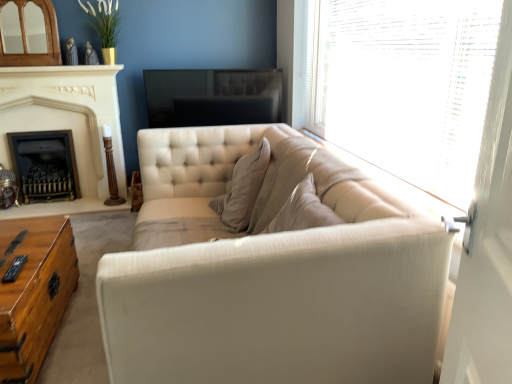
Question: From a real-world perspective, is wooden trunk at lower left above or below white stone fireplace at left, the 2th fireplace in the left-to-right sequence?

Choices:
 (A) below
 (B) above

Answer: (A)

Question: From their relative heights in the image, would you say wooden trunk at lower left is taller or shorter than white stone fireplace at left, the 2th fireplace in the left-to-right sequence?

Choices:
 (A) short
 (B) tall

Answer: (A)

Question: Considering the real-world distances, which object is farthest from the satin beige couch at center?

Choices:
 (A) wooden trunk at lower left
 (B) black metal fireplace at left, positioned as the first fireplace in left-to-right order
 (C) translucent wood blinds at upper right
 (D) white stone fireplace at left, positioned as the 1th fireplace in right-to-left order

Answer: (B)

Question: Which of these objects is positioned closest to the white stone fireplace at left, positioned as the 1th fireplace in right-to-left order?

Choices:
 (A) wooden trunk at lower left
 (B) satin beige couch at center
 (C) translucent wood blinds at upper right
 (D) black metal fireplace at left, the second fireplace from the right

Answer: (D)